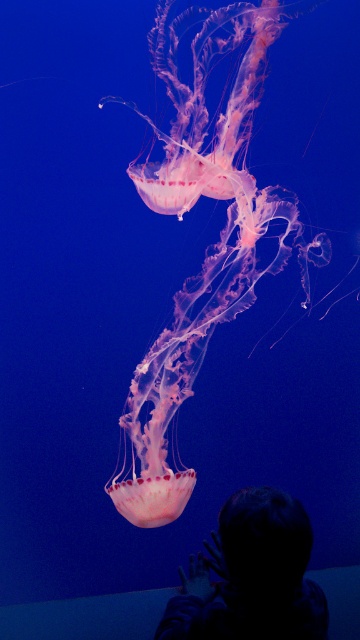
Is translucent pink jellyfish at center wider than silhouette hair at lower center?

Yes, translucent pink jellyfish at center is wider than silhouette hair at lower center.

You are a GUI agent. You are given a task and a screenshot of the screen. Output one action in this format:
    pyautogui.click(x=<x>, y=<y>)
    Task: Click on the translucent pink jellyfish at center
    This screenshot has width=360, height=640.
    Given the screenshot: What is the action you would take?
    pyautogui.click(x=208, y=250)